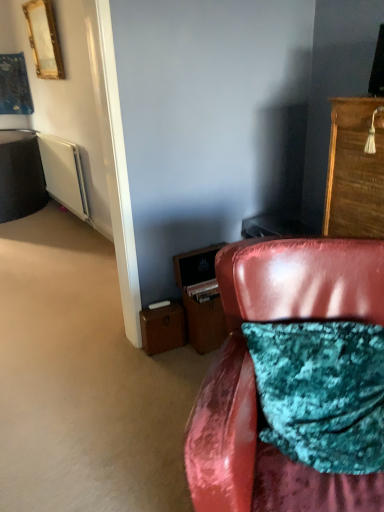
At what (x,y) coordinates should I click in order to perform the action: click on free location above wooden drawer at lower center, marked as the 1th drawer in a right-to-left arrangement (from a real-world perspective). Please return your answer as a coordinate pair (x, y). Image resolution: width=384 pixels, height=512 pixels. Looking at the image, I should click on (204, 287).